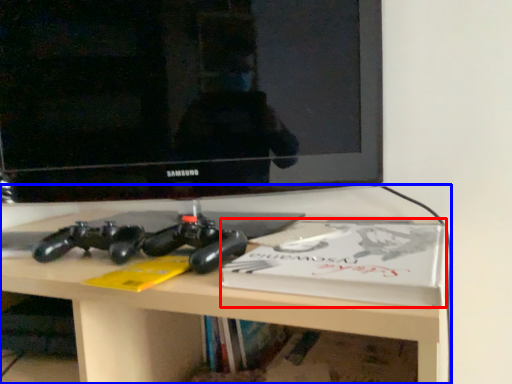
Question: Which point is further to the camera, paperback book (highlighted by a red box) or desk (highlighted by a blue box)?

Choices:
 (A) paperback book
 (B) desk

Answer: (A)